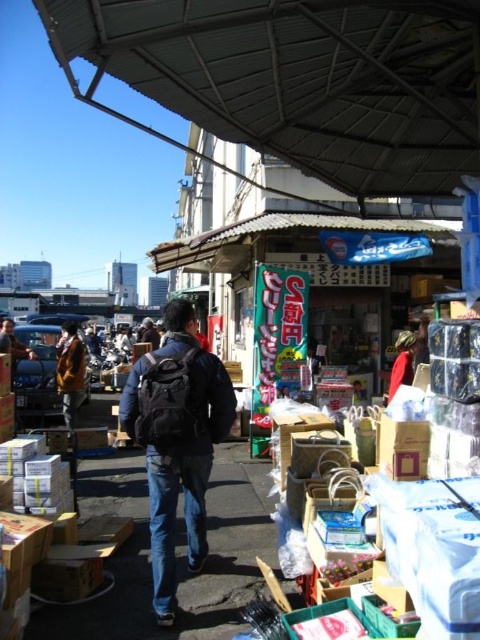
How far apart are metallic gray canopy at upper center and red fabric bag at center?

9.45 feet

Who is lower down, metallic gray canopy at upper center or red fabric bag at center?

red fabric bag at center

The image size is (480, 640). Describe the element at coordinates (300, 77) in the screenshot. I see `metallic gray canopy at upper center` at that location.

Find the location of a particular element. Image resolution: width=480 pixels, height=640 pixels. metallic gray canopy at upper center is located at coordinates (300, 77).

Between yellow fabric jacket at center and red fabric bag at center, which one appears on the right side from the viewer's perspective?

From the viewer's perspective, red fabric bag at center appears more on the right side.

Is point (69, 381) less distant than point (402, 355)?

No, it is not.

Find the location of a particular element. Image resolution: width=480 pixels, height=640 pixels. yellow fabric jacket at center is located at coordinates (70, 371).

Find the location of a particular element. The width and height of the screenshot is (480, 640). yellow fabric jacket at center is located at coordinates (70, 371).

Which is in front, point (149, 436) or point (67, 422)?

Point (149, 436)

This screenshot has height=640, width=480. What are the coordinates of `black backpack at center` in the screenshot? It's located at (177, 440).